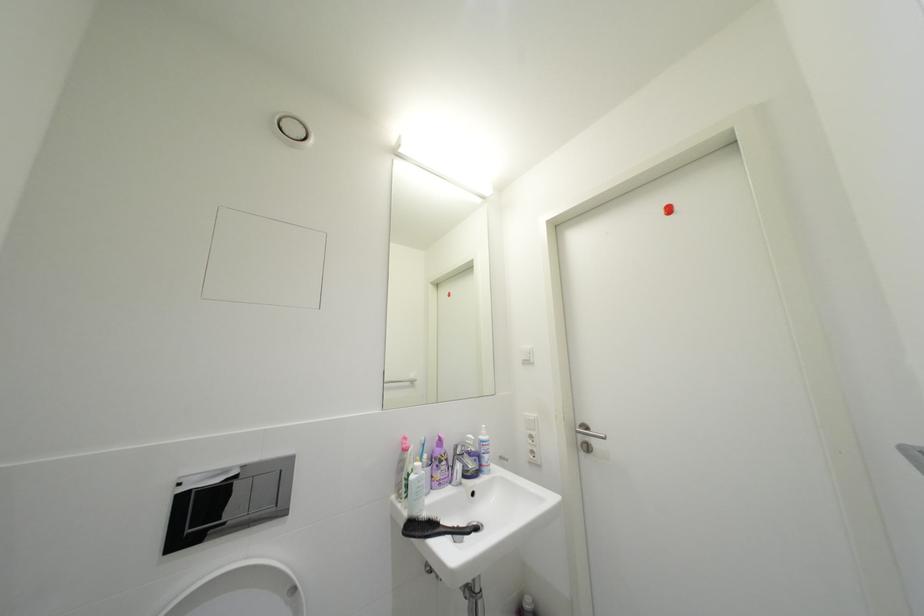
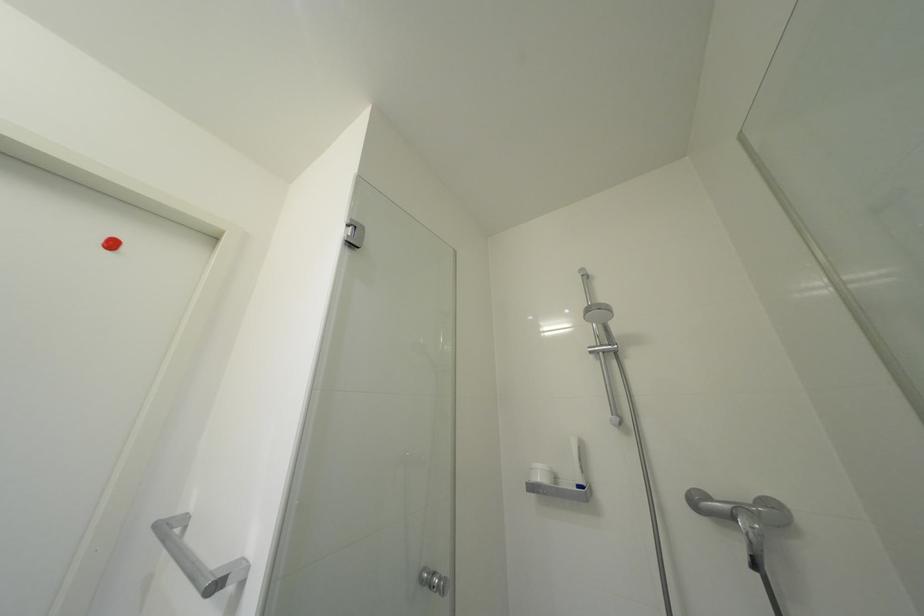
How did the camera likely rotate?

The camera's rotation is toward right-up.